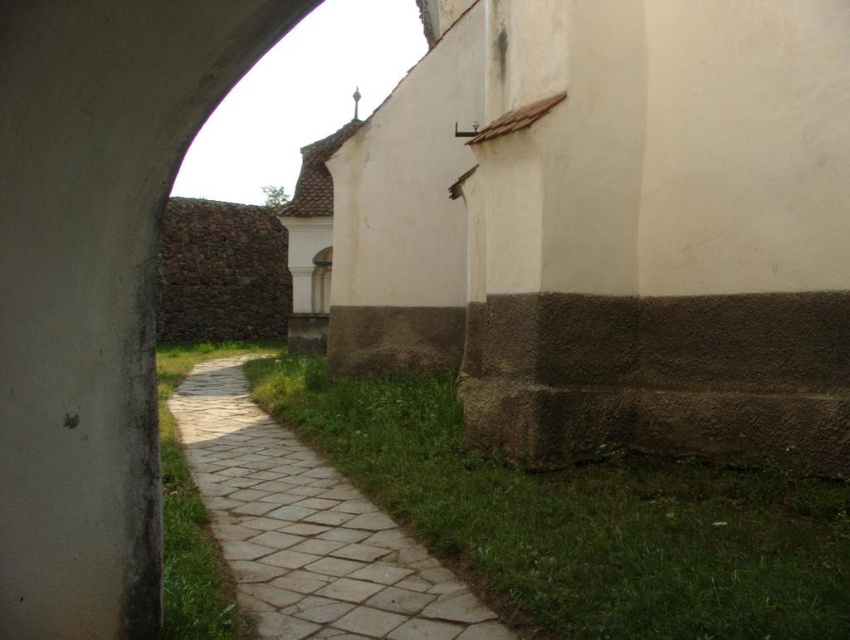
Question: Can you confirm if green grass at lower right is bigger than natural stone path at center?

Choices:
 (A) yes
 (B) no

Answer: (A)

Question: Does green grass at lower right have a smaller size compared to natural stone path at center?

Choices:
 (A) no
 (B) yes

Answer: (A)

Question: Which of the following is the closest to the observer?

Choices:
 (A) (446, 497)
 (B) (380, 618)

Answer: (B)

Question: Can you confirm if green grass at lower right is bigger than natural stone path at center?

Choices:
 (A) no
 (B) yes

Answer: (B)

Question: Which object is closer to the camera taking this photo?

Choices:
 (A) green grass at lower right
 (B) natural stone path at center

Answer: (A)